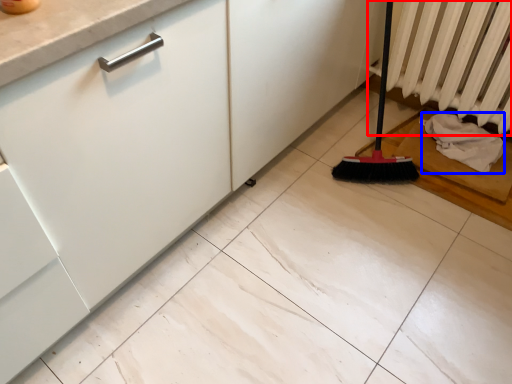
Question: Which object is further to the camera taking this photo, radiator (highlighted by a red box) or material (highlighted by a blue box)?

Choices:
 (A) radiator
 (B) material

Answer: (B)